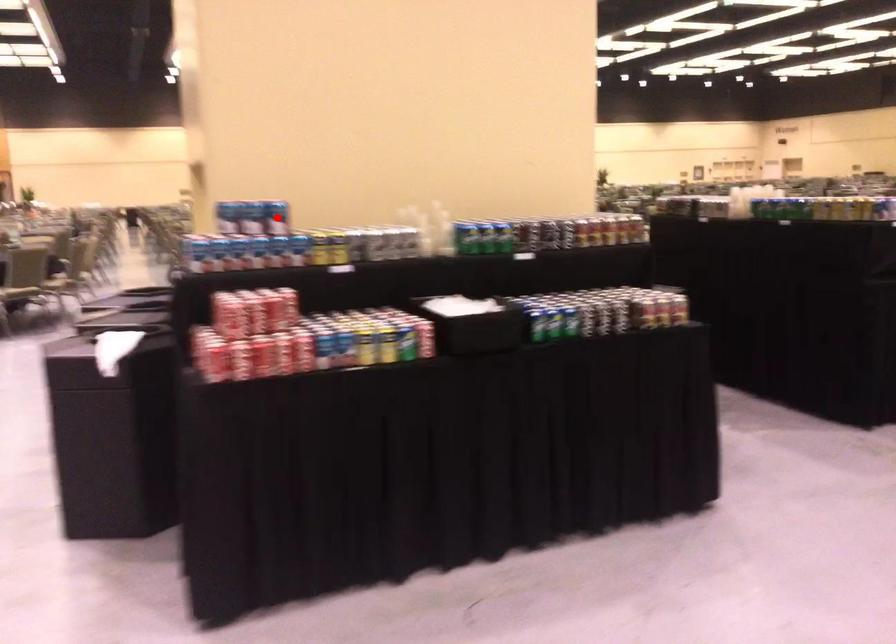
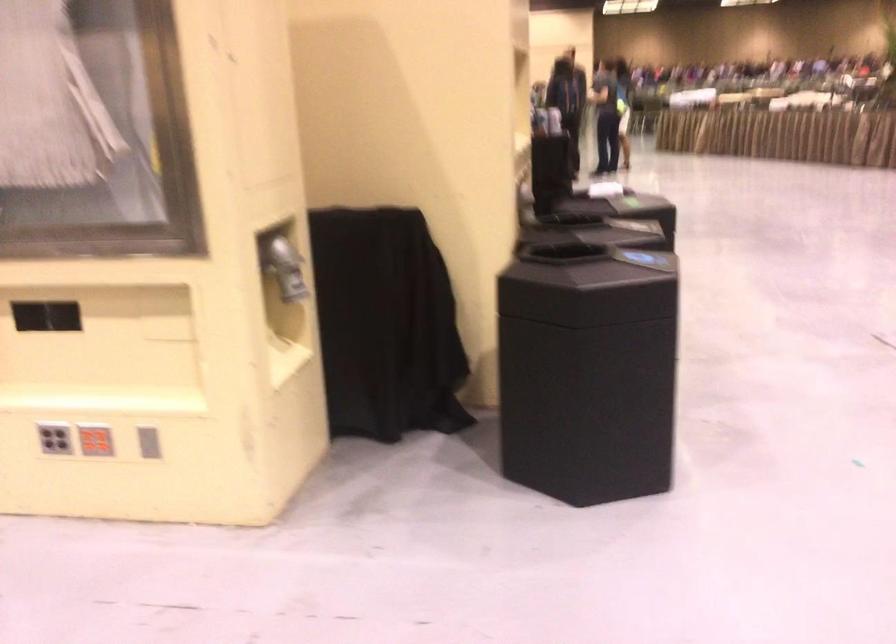
Question: I am providing you with two images of the same scene from different viewpoints. A red point is marked on the first image. Is the red point's position out of view in image 2?

Choices:
 (A) Yes
 (B) No

Answer: (A)